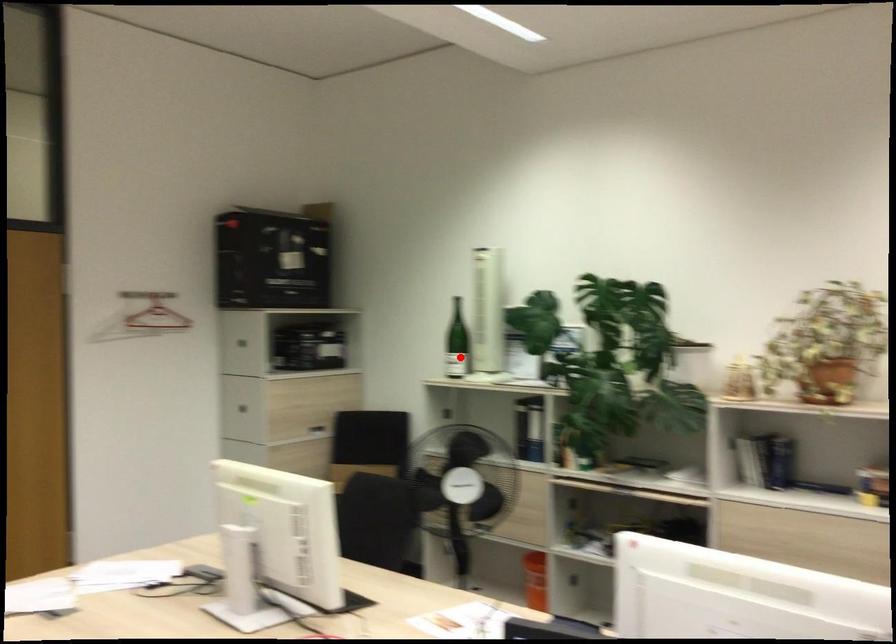
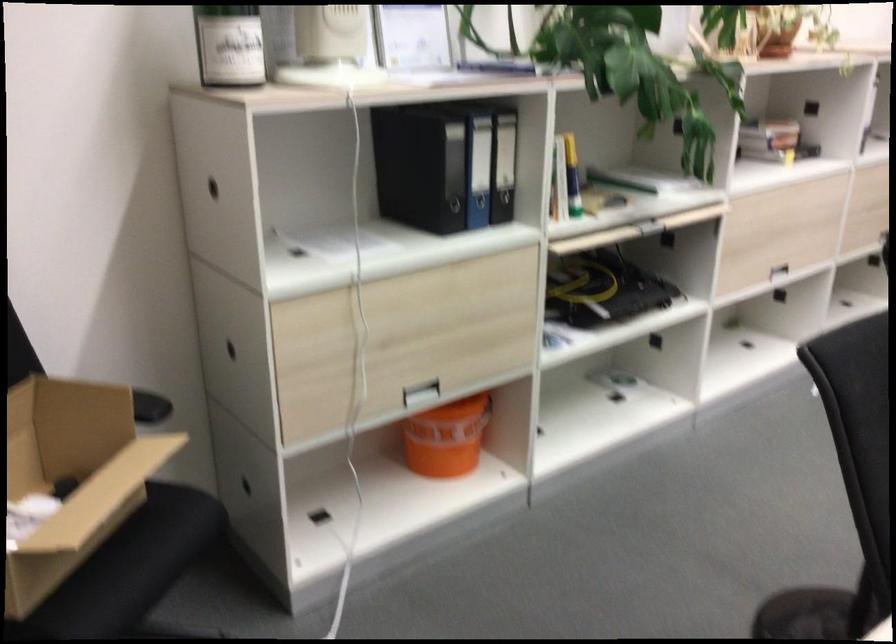
Where in the second image is the point corresponding to the highlighted location from the first image?

(229, 44)